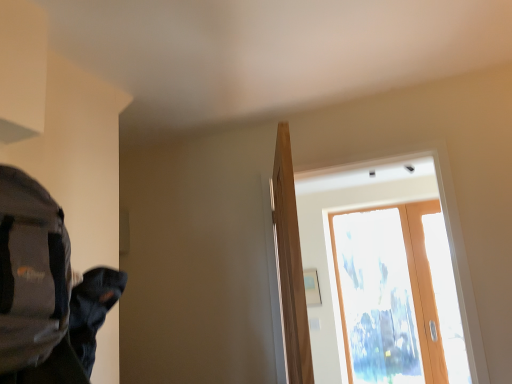
Question: Is gray fabric backpack at left wider than transparent glass door at upper right?

Choices:
 (A) yes
 (B) no

Answer: (A)

Question: Is the surface of gray fabric backpack at left in direct contact with transparent glass door at upper right?

Choices:
 (A) no
 (B) yes

Answer: (A)

Question: Does gray fabric backpack at left have a larger size compared to transparent glass door at upper right?

Choices:
 (A) no
 (B) yes

Answer: (A)

Question: From the image's perspective, is gray fabric backpack at left over transparent glass door at upper right?

Choices:
 (A) yes
 (B) no

Answer: (A)

Question: From a real-world perspective, is gray fabric backpack at left located higher than transparent glass door at upper right?

Choices:
 (A) yes
 (B) no

Answer: (A)

Question: Can you confirm if gray fabric backpack at left is taller than transparent glass door at upper right?

Choices:
 (A) yes
 (B) no

Answer: (B)

Question: Can you confirm if light brown wood door at center is shorter than gray fabric backpack at left?

Choices:
 (A) no
 (B) yes

Answer: (A)

Question: Is gray fabric backpack at left at the back of light brown wood door at center?

Choices:
 (A) no
 (B) yes

Answer: (A)

Question: From a real-world perspective, is light brown wood door at center located beneath gray fabric backpack at left?

Choices:
 (A) yes
 (B) no

Answer: (A)

Question: Is light brown wood door at center to the right of gray fabric backpack at left from the viewer's perspective?

Choices:
 (A) no
 (B) yes

Answer: (B)

Question: Is light brown wood door at center far away from gray fabric backpack at left?

Choices:
 (A) yes
 (B) no

Answer: (B)

Question: Does light brown wood door at center contain gray fabric backpack at left?

Choices:
 (A) yes
 (B) no

Answer: (B)

Question: Does transparent glass door at upper center have a greater height compared to gray fabric backpack at left?

Choices:
 (A) yes
 (B) no

Answer: (A)